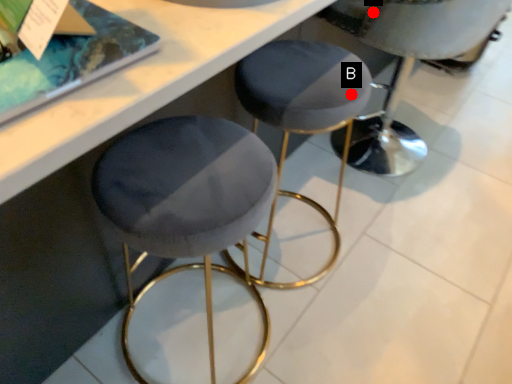
Question: Two points are circled on the image, labeled by A and B beside each circle. Which of the following is the farthest from the observer?

Choices:
 (A) A is further
 (B) B is further

Answer: (A)